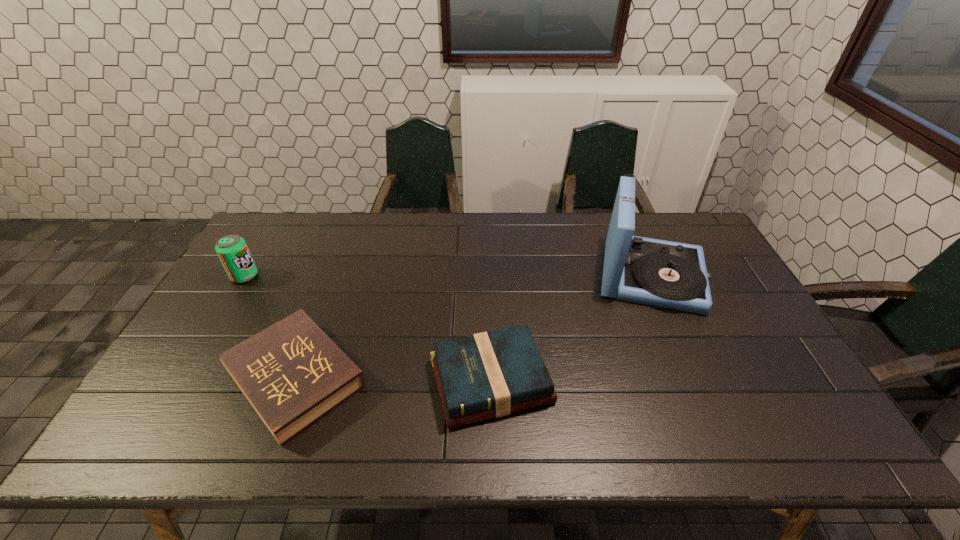
The image size is (960, 540). Identify the location of the rightmost object. (666, 274).

This screenshot has width=960, height=540. Identify the location of the tallest object. (666, 274).

Find the location of a particular element. pop soda is located at coordinates (232, 250).

Find the location of a particular element. The height and width of the screenshot is (540, 960). the leftmost object is located at coordinates (232, 250).

Find the location of a particular element. the right hardback book is located at coordinates (487, 375).

You are a GUI agent. You are given a task and a screenshot of the screen. Output one action in this format:
    pyautogui.click(x=<x>, y=<y>)
    Task: Click on the shorter hardback book
    Image resolution: width=960 pixels, height=540 pixels.
    Given the screenshot: What is the action you would take?
    pos(292,373)

Find the location of a particular element. The height and width of the screenshot is (540, 960). the third object from right to left is located at coordinates (292, 373).

Find the location of `vacant space situated 0.140m on the left of the rightmost object`. vacant space situated 0.140m on the left of the rightmost object is located at coordinates (550, 276).

At what (x,y) coordinates should I click in order to perform the action: click on vacant space located 0.290m on the front-facing side of the leftmost object. Please return your answer as a coordinate pair (x, y). Looking at the image, I should click on (349, 276).

In order to click on vacant space located on the back of the right hardback book in this screenshot , I will do `click(489, 282)`.